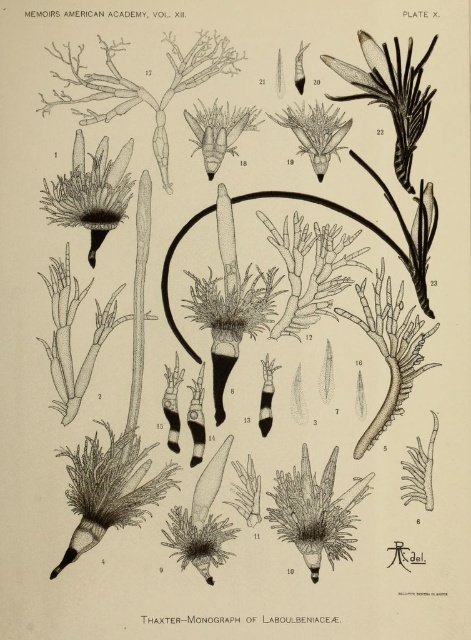
In the scene shown: Who is positioned more to the right, dark brown textured flower at upper left or dark green textured flower at center?

Positioned to the right is dark green textured flower at center.

Does dark brown textured flower at upper left have a greater width compared to dark green textured flower at center?

Yes, dark brown textured flower at upper left is wider than dark green textured flower at center.

Is point (72, 152) closer to camera compared to point (322, 141)?

Yes, it is in front of point (322, 141).

This screenshot has height=640, width=471. What are the coordinates of `dark brown textured flower at upper left` in the screenshot? It's located at (90, 193).